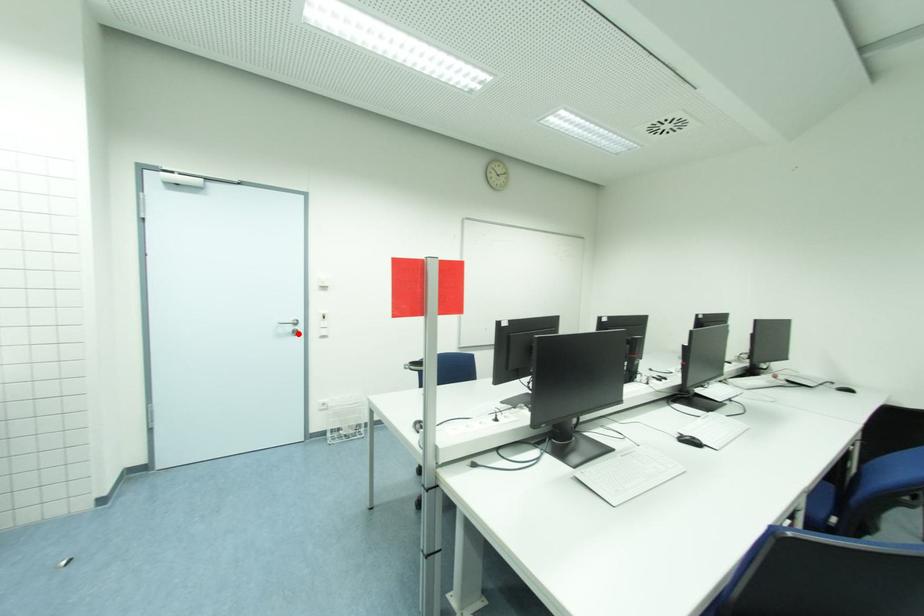
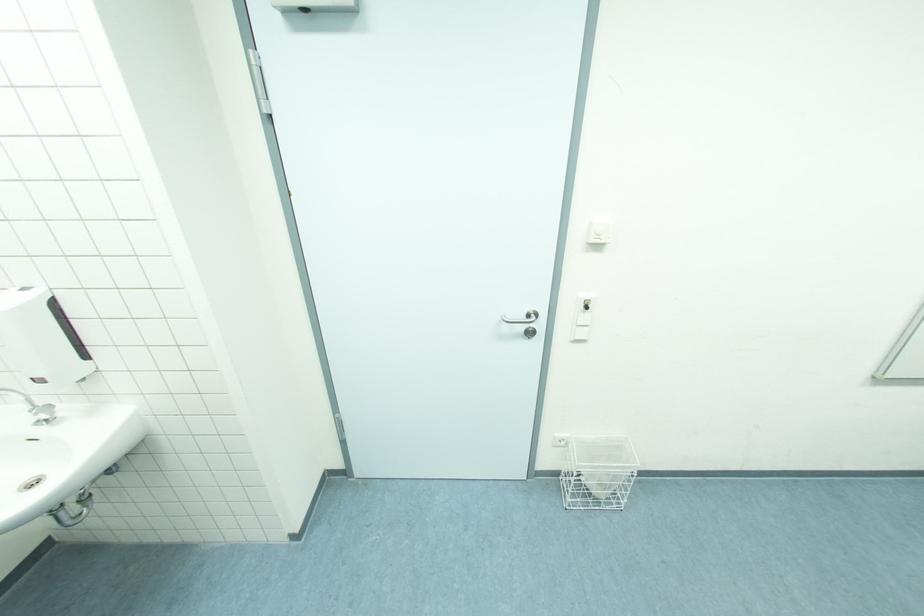
Where in the second image is the point corresponding to the highlighted location from the first image?

(532, 334)